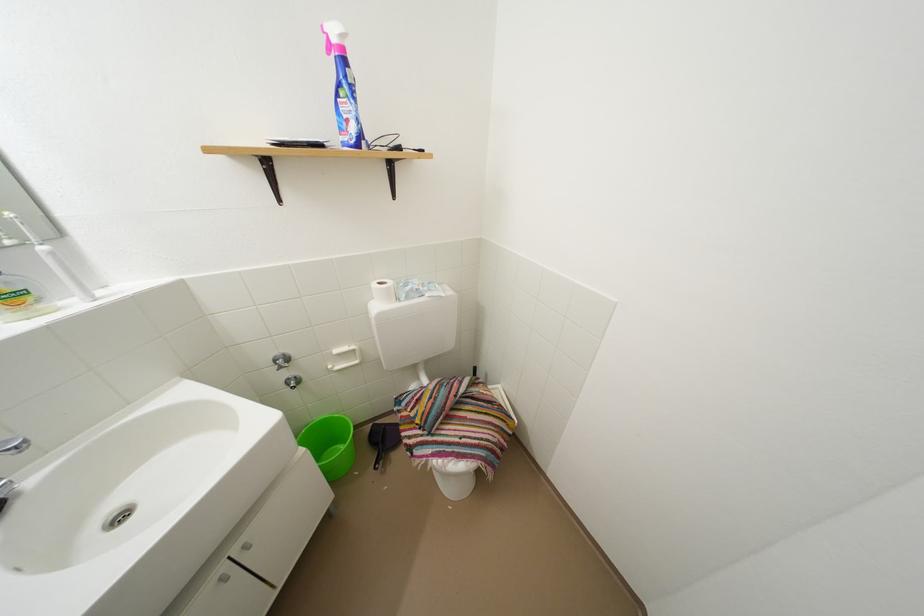
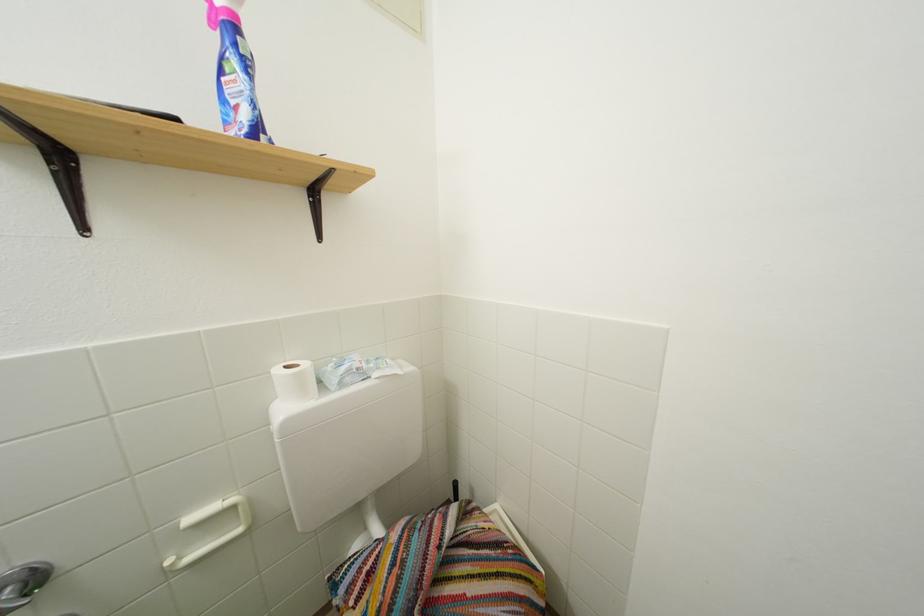
Question: Based on the continuous images, in which direction is the camera rotating? Reply with the corresponding letter.

Choices:
 (A) Left
 (B) Right
 (C) Up
 (D) Down

Answer: (C)